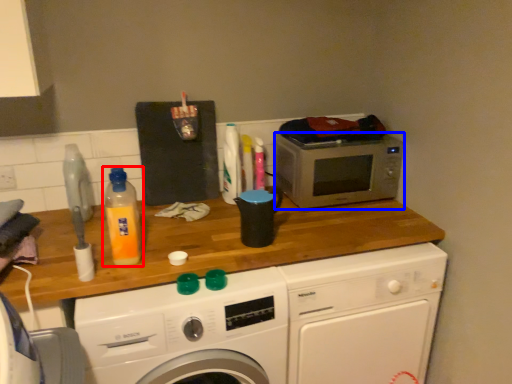
Question: Among these objects, which one is farthest to the camera, bottle (highlighted by a red box) or microwave oven (highlighted by a blue box)?

Choices:
 (A) bottle
 (B) microwave oven

Answer: (B)